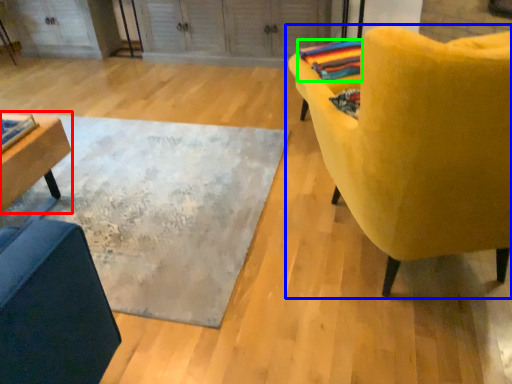
Question: Which object is the closest to the table (highlighted by a red box)? Choose among these: chair (highlighted by a blue box) or blanket (highlighted by a green box).

Choices:
 (A) chair
 (B) blanket

Answer: (A)